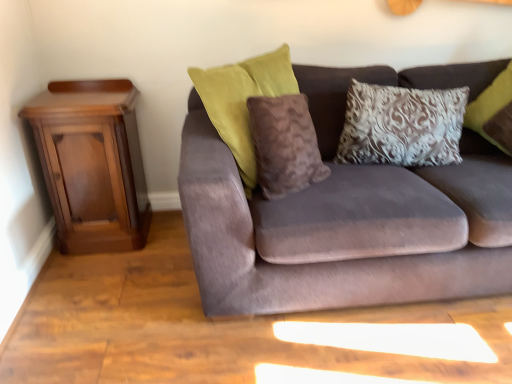
What do you see at coordinates (402, 126) in the screenshot?
I see `silver textured pillow at upper right, which is the first pillow from right to left` at bounding box center [402, 126].

This screenshot has height=384, width=512. In order to click on brown fuzzy pillow at center, which is counted as the 2th pillow, starting from the right in this screenshot , I will do `click(284, 145)`.

Considering the positions of objects mahogany wood nightstand at left and velvet brown couch at center in the image provided, who is in front, mahogany wood nightstand at left or velvet brown couch at center?

velvet brown couch at center is closer to the camera.

Between mahogany wood nightstand at left and velvet brown couch at center, which one has larger size?

Bigger between the two is velvet brown couch at center.

Does mahogany wood nightstand at left appear on the right side of velvet brown couch at center?

No, mahogany wood nightstand at left is not to the right of velvet brown couch at center.

Is velvet brown couch at center surrounded by mahogany wood nightstand at left?

Actually, velvet brown couch at center is outside mahogany wood nightstand at left.

Does point (249, 203) come in front of point (270, 107)?

No, it is not.

Looking at this image, considering the sizes of velvet brown couch at center and brown fuzzy pillow at center, which is counted as the 2th pillow, starting from the right, in the image, is velvet brown couch at center bigger or smaller than brown fuzzy pillow at center, which is counted as the 2th pillow, starting from the right,?

Clearly, velvet brown couch at center is larger in size than brown fuzzy pillow at center, which is counted as the 2th pillow, starting from the right.

Between velvet brown couch at center and brown fuzzy pillow at center, which ranks as the 1th pillow in left-to-right order, which one has larger width?

velvet brown couch at center is wider.

Based on the photo, is velvet brown couch at center looking in the opposite direction of silver textured pillow at upper right, the 2th pillow from the left?

Yes, velvet brown couch at center's orientation is away from silver textured pillow at upper right, the 2th pillow from the left.

Considering the sizes of objects velvet brown couch at center and silver textured pillow at upper right, the 2th pillow from the left, in the image provided, who is taller, velvet brown couch at center or silver textured pillow at upper right, the 2th pillow from the left,?

With more height is velvet brown couch at center.

Considering the positions of objects velvet brown couch at center and silver textured pillow at upper right, the 2th pillow from the left, in the image provided, who is more to the left, velvet brown couch at center or silver textured pillow at upper right, the 2th pillow from the left,?

From the viewer's perspective, velvet brown couch at center appears more on the left side.

Between point (325, 70) and point (447, 114), which one is positioned behind?

The point (325, 70) is more distant.

From a real-world perspective, between mahogany wood nightstand at left and silver textured pillow at upper right, which is the first pillow from right to left, who is vertically lower?

In real-world perspective, mahogany wood nightstand at left is lower.

Where is `nightstand on the left of silver textured pillow at upper right, which is the first pillow from right to left`? This screenshot has width=512, height=384. nightstand on the left of silver textured pillow at upper right, which is the first pillow from right to left is located at coordinates (92, 164).

From the image's perspective, is mahogany wood nightstand at left on top of silver textured pillow at upper right, the 2th pillow from the left?

No, from the image's perspective, mahogany wood nightstand at left is not on top of silver textured pillow at upper right, the 2th pillow from the left.

Are mahogany wood nightstand at left and silver textured pillow at upper right, the 2th pillow from the left, located far from each other?

Absolutely, mahogany wood nightstand at left is distant from silver textured pillow at upper right, the 2th pillow from the left.

I want to click on studio couch in front of the brown fuzzy pillow at center, which ranks as the 1th pillow in left-to-right order, so click(x=349, y=213).

From the image's perspective, is brown fuzzy pillow at center, which ranks as the 1th pillow in left-to-right order, located above velvet brown couch at center?

Indeed, from the image's perspective, brown fuzzy pillow at center, which ranks as the 1th pillow in left-to-right order, is shown above velvet brown couch at center.

Is brown fuzzy pillow at center, which is counted as the 2th pillow, starting from the right, beside velvet brown couch at center?

No, brown fuzzy pillow at center, which is counted as the 2th pillow, starting from the right, is not making contact with velvet brown couch at center.

From a real-world perspective, is brown fuzzy pillow at center, which ranks as the 1th pillow in left-to-right order, physically below silver textured pillow at upper right, the 2th pillow from the left?

No.

In the image, there is a silver textured pillow at upper right, which is the first pillow from right to left. In order to click on pillow below it (from the image's perspective) in this screenshot , I will do `click(284, 145)`.

Is silver textured pillow at upper right, which is the first pillow from right to left, inside brown fuzzy pillow at center, which ranks as the 1th pillow in left-to-right order?

Actually, silver textured pillow at upper right, which is the first pillow from right to left, is outside brown fuzzy pillow at center, which ranks as the 1th pillow in left-to-right order.

Is brown fuzzy pillow at center, which ranks as the 1th pillow in left-to-right order, positioned far away from silver textured pillow at upper right, which is the first pillow from right to left?

That's not correct — brown fuzzy pillow at center, which ranks as the 1th pillow in left-to-right order, is a little close to silver textured pillow at upper right, which is the first pillow from right to left.

Is velvet brown couch at center facing towards mahogany wood nightstand at left?

No.

Between velvet brown couch at center and mahogany wood nightstand at left, which one appears on the right side from the viewer's perspective?

Positioned to the right is velvet brown couch at center.

Is velvet brown couch at center next to mahogany wood nightstand at left?

velvet brown couch at center is not next to mahogany wood nightstand at left, and they're not touching.

Identify the location of nightstand that is on the left side of velvet brown couch at center. (92, 164).

Locate an element on the screen. The height and width of the screenshot is (384, 512). nightstand located underneath the velvet brown couch at center (from a real-world perspective) is located at coordinates (92, 164).

The image size is (512, 384). Identify the location of studio couch lying below the brown fuzzy pillow at center, which ranks as the 1th pillow in left-to-right order (from the image's perspective). (349, 213).

Based on their spatial positions, is mahogany wood nightstand at left or velvet brown couch at center further from brown fuzzy pillow at center, which ranks as the 1th pillow in left-to-right order?

mahogany wood nightstand at left is further to brown fuzzy pillow at center, which ranks as the 1th pillow in left-to-right order.

Based on the photo, estimate the real-world distances between objects in this image. Which object is closer to mahogany wood nightstand at left, brown fuzzy pillow at center, which is counted as the 2th pillow, starting from the right, or silver textured pillow at upper right, which is the first pillow from right to left?

brown fuzzy pillow at center, which is counted as the 2th pillow, starting from the right, is positioned closer to the anchor mahogany wood nightstand at left.

Looking at the image, which one is located closer to velvet brown couch at center, brown fuzzy pillow at center, which ranks as the 1th pillow in left-to-right order, or silver textured pillow at upper right, the 2th pillow from the left?

brown fuzzy pillow at center, which ranks as the 1th pillow in left-to-right order, is positioned closer to the anchor velvet brown couch at center.

From the image, which object appears to be nearer to mahogany wood nightstand at left, velvet brown couch at center or brown fuzzy pillow at center, which is counted as the 2th pillow, starting from the right?

brown fuzzy pillow at center, which is counted as the 2th pillow, starting from the right, is closer to mahogany wood nightstand at left.

Based on the photo, looking at the image, which one is located closer to silver textured pillow at upper right, which is the first pillow from right to left, brown fuzzy pillow at center, which ranks as the 1th pillow in left-to-right order, or velvet brown couch at center?

Among the two, velvet brown couch at center is located nearer to silver textured pillow at upper right, which is the first pillow from right to left.

When comparing their distances from silver textured pillow at upper right, the 2th pillow from the left, does mahogany wood nightstand at left or velvet brown couch at center seem closer?

velvet brown couch at center is positioned closer to the anchor silver textured pillow at upper right, the 2th pillow from the left.

Based on the photo, from the image, which object appears to be nearer to mahogany wood nightstand at left, velvet brown couch at center or silver textured pillow at upper right, which is the first pillow from right to left?

The object closer to mahogany wood nightstand at left is velvet brown couch at center.

In the scene shown: Estimate the real-world distances between objects in this image. Which object is closer to brown fuzzy pillow at center, which ranks as the 1th pillow in left-to-right order, mahogany wood nightstand at left or silver textured pillow at upper right, which is the first pillow from right to left?

The object closer to brown fuzzy pillow at center, which ranks as the 1th pillow in left-to-right order, is silver textured pillow at upper right, which is the first pillow from right to left.

Locate an element on the screen. The width and height of the screenshot is (512, 384). pillow situated between mahogany wood nightstand at left and velvet brown couch at center from left to right is located at coordinates (284, 145).

Where is `studio couch situated between brown fuzzy pillow at center, which ranks as the 1th pillow in left-to-right order, and silver textured pillow at upper right, which is the first pillow from right to left, from left to right`? The image size is (512, 384). studio couch situated between brown fuzzy pillow at center, which ranks as the 1th pillow in left-to-right order, and silver textured pillow at upper right, which is the first pillow from right to left, from left to right is located at coordinates (349, 213).

Locate an element on the screen. Image resolution: width=512 pixels, height=384 pixels. pillow situated between mahogany wood nightstand at left and silver textured pillow at upper right, the 2th pillow from the left, from left to right is located at coordinates (284, 145).

The width and height of the screenshot is (512, 384). In order to click on studio couch between mahogany wood nightstand at left and silver textured pillow at upper right, the 2th pillow from the left in this screenshot , I will do `click(349, 213)`.